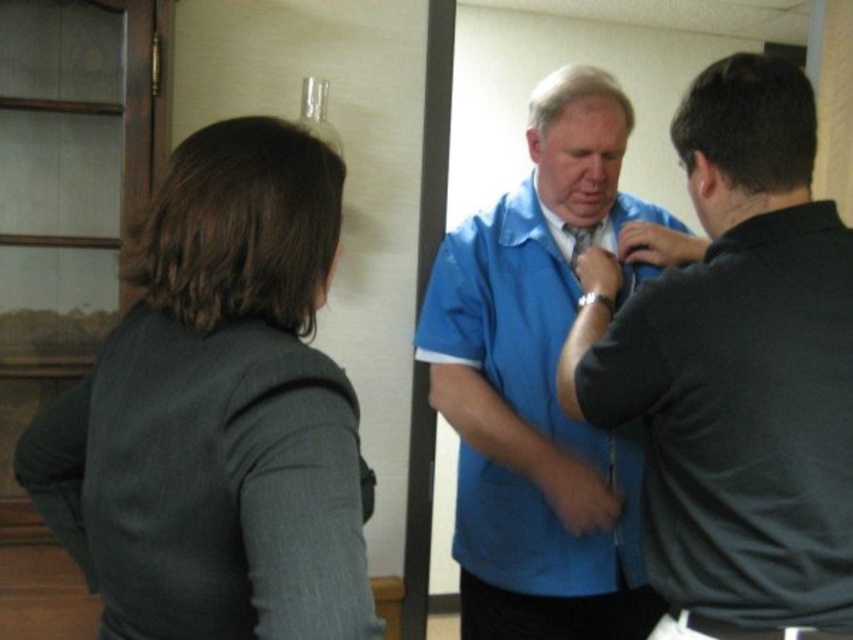
You are standing in the room and see the point at coordinates point (837, 488). Can you reach it without moving your feet?

The point (837, 488) is 1.09 meters from the viewer. Since this distance is beyond typical arm reach, you cannot reach it without moving your feet.

You are a photographer positioned in front of the scene. You want to take a photo that captures both the dark gray sweater at left and the matte blue shirt at center clearly. Which object should you focus on first to ensure both are in focus?

The dark gray sweater at left is closer to the viewer than the matte blue shirt at center. To ensure both are in focus, you should focus on the matte blue shirt at center first, as focusing on the farther object allows the closer object to also be in focus within the depth of field.

You are organizing a charity event and need to ensure all donated clothing items fit properly. You have a matte blue shirt at center and a matte blue tie at center. Which item requires more space when packing?

The matte blue shirt at center requires more space when packing because it is larger in size compared to the matte blue tie at center.